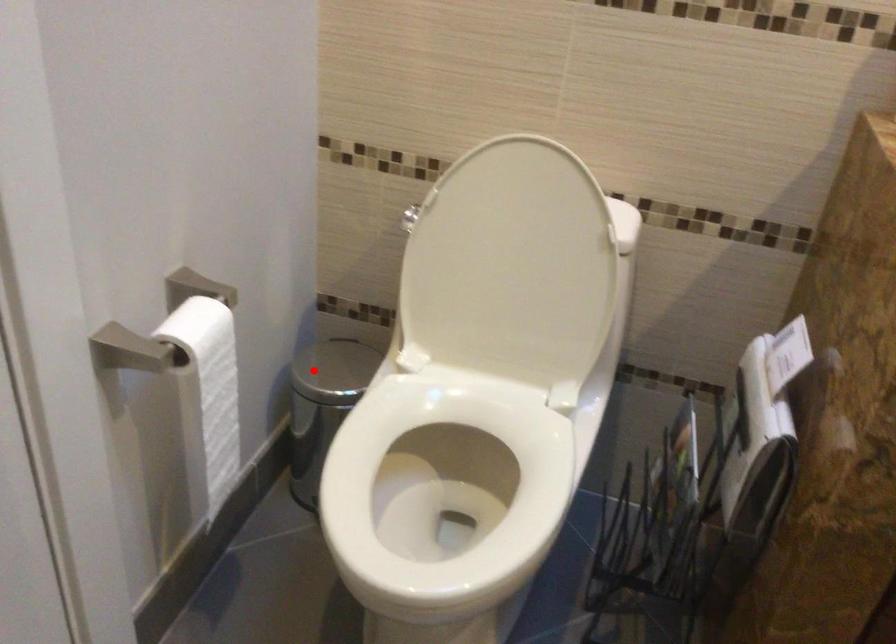
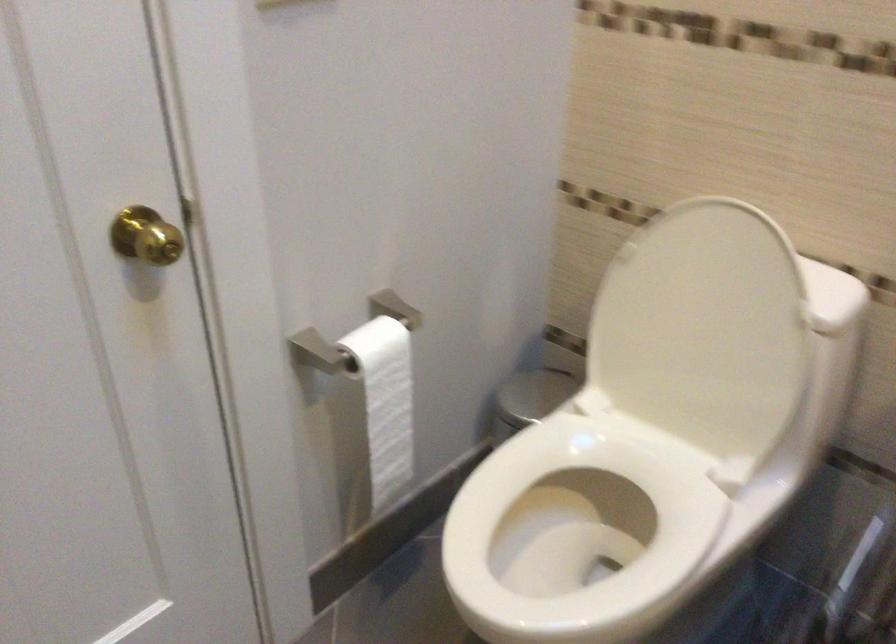
Where in the second image is the point corresponding to the highlighted location from the first image?

(532, 395)